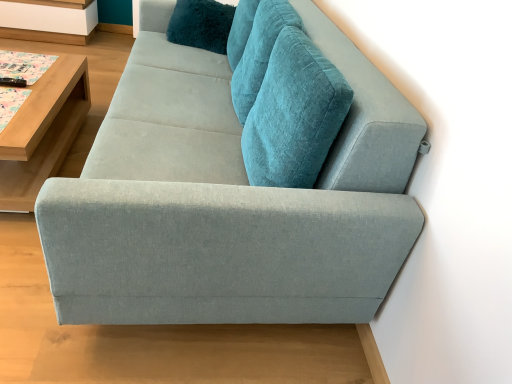
Question: Considering the relative sizes of light wood/wooden table at left and light gray fabric couch at center in the image provided, is light wood/wooden table at left bigger than light gray fabric couch at center?

Choices:
 (A) no
 (B) yes

Answer: (A)

Question: Considering the relative sizes of light wood/wooden table at left and light gray fabric couch at center in the image provided, is light wood/wooden table at left smaller than light gray fabric couch at center?

Choices:
 (A) yes
 (B) no

Answer: (A)

Question: From the image's perspective, is light wood/wooden table at left below light gray fabric couch at center?

Choices:
 (A) no
 (B) yes

Answer: (B)

Question: Is the depth of light wood/wooden table at left less than that of light gray fabric couch at center?

Choices:
 (A) yes
 (B) no

Answer: (B)

Question: Is light wood/wooden table at left taller than light gray fabric couch at center?

Choices:
 (A) yes
 (B) no

Answer: (B)

Question: From a real-world perspective, is light wood/wooden table at left located beneath light gray fabric couch at center?

Choices:
 (A) yes
 (B) no

Answer: (A)

Question: Is light gray fabric couch at center facing away from light wood/wooden table at left?

Choices:
 (A) yes
 (B) no

Answer: (B)

Question: Can you confirm if light gray fabric couch at center is thinner than light wood/wooden table at left?

Choices:
 (A) yes
 (B) no

Answer: (B)

Question: Is light wood/wooden table at left surrounded by light gray fabric couch at center?

Choices:
 (A) no
 (B) yes

Answer: (A)

Question: Is light gray fabric couch at center to the left of light wood/wooden table at left from the viewer's perspective?

Choices:
 (A) no
 (B) yes

Answer: (A)

Question: Can you confirm if light gray fabric couch at center is bigger than light wood/wooden table at left?

Choices:
 (A) no
 (B) yes

Answer: (B)

Question: Is light gray fabric couch at center wider than light wood/wooden table at left?

Choices:
 (A) yes
 (B) no

Answer: (A)

Question: From the image's perspective, is white wood shelf at upper left below teal plush pillow at upper center?

Choices:
 (A) no
 (B) yes

Answer: (A)